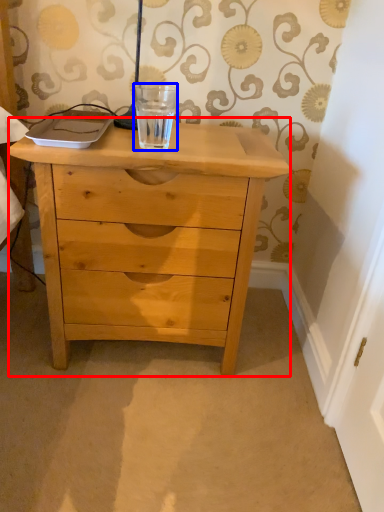
Question: Which point is closer to the camera, chest of drawers (highlighted by a red box) or beverage (highlighted by a blue box)?

Choices:
 (A) chest of drawers
 (B) beverage

Answer: (A)